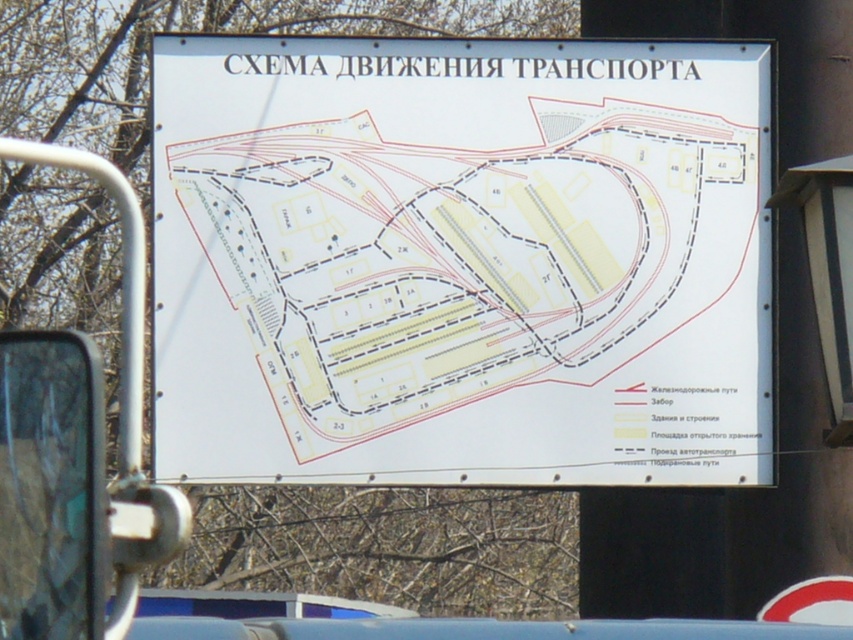
Which is more to the right, white paper sign at center or white plastic sign at upper center?

Positioned to the right is white plastic sign at upper center.

Is white paper sign at center positioned behind white plastic sign at upper center?

No, white paper sign at center is closer to the viewer.

Is point (561, 138) farther from viewer compared to point (776, 81)?

No, it is in front of (776, 81).

This screenshot has height=640, width=853. Identify the location of white paper sign at center. (461, 260).